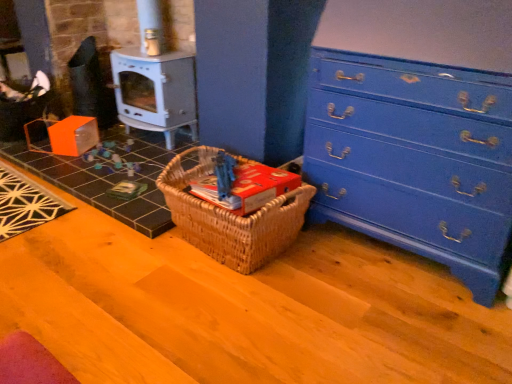
Locate an element on the screen. This screenshot has width=512, height=384. vacant space in front of woven wood picnic basket at center is located at coordinates (228, 310).